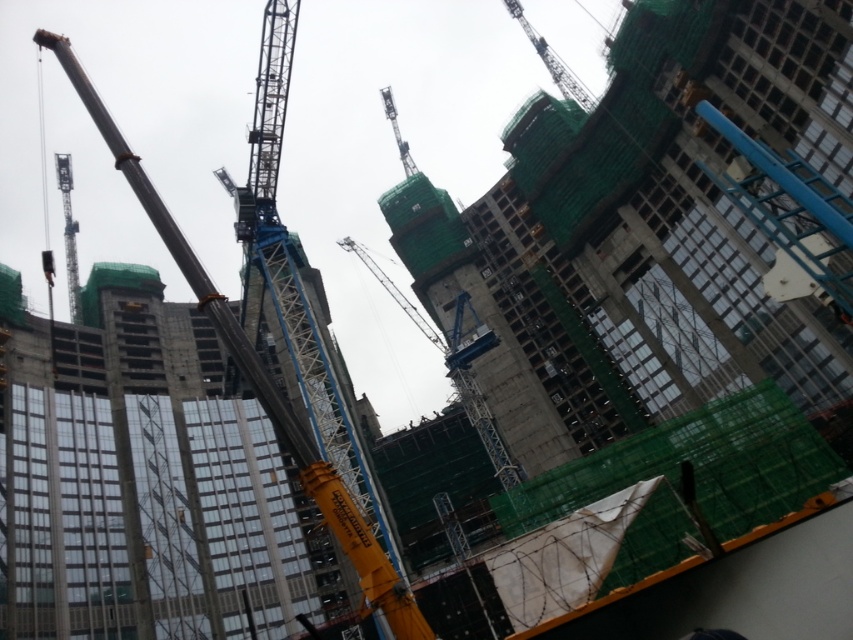
You are an engineer assessing the construction site. You need to determine which crane has a higher vantage point for monitoring the site. Which one is taller between the metallic blue crane at left and the metallic blue crane at upper center?

The metallic blue crane at left is much taller than the metallic blue crane at upper center, so it has a higher vantage point for monitoring the site.

You are an inspector evaluating the construction site. You notice the green netted construction at upper center and the yellow metallic crane at left. Which object occupies a greater area in the image?

The green netted construction at upper center has a larger size compared to the yellow metallic crane at left, so it occupies a greater area in the image.